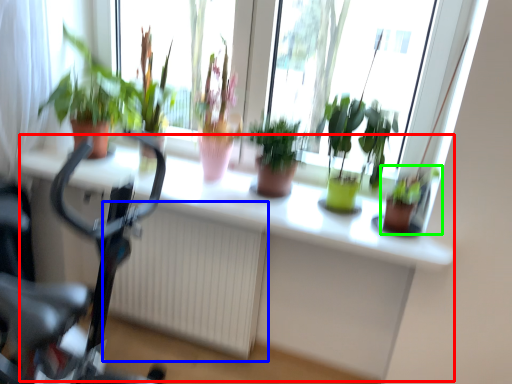
Question: Which is nearer to the computer desk (highlighted by a red box)? radiator (highlighted by a blue box) or houseplant (highlighted by a green box).

Choices:
 (A) radiator
 (B) houseplant

Answer: (A)